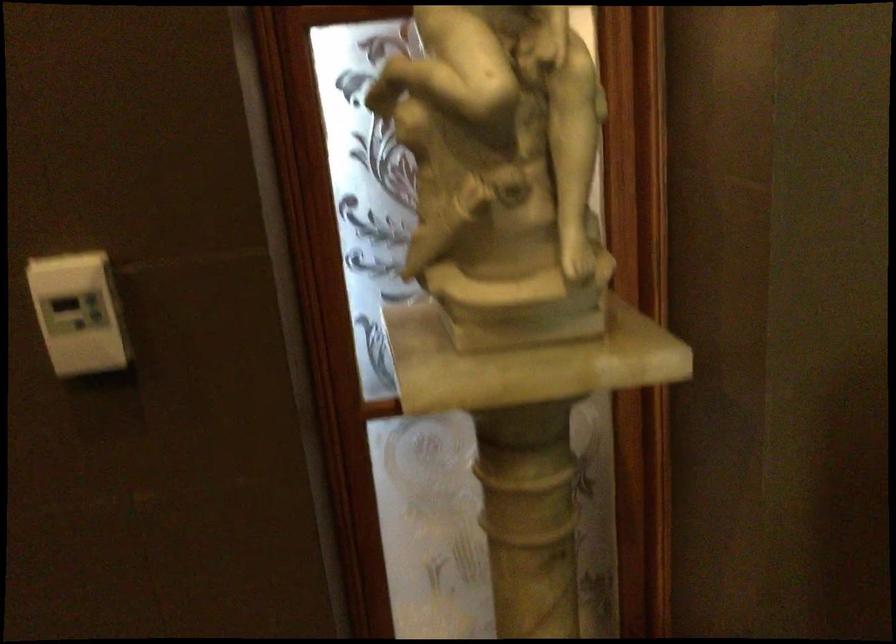
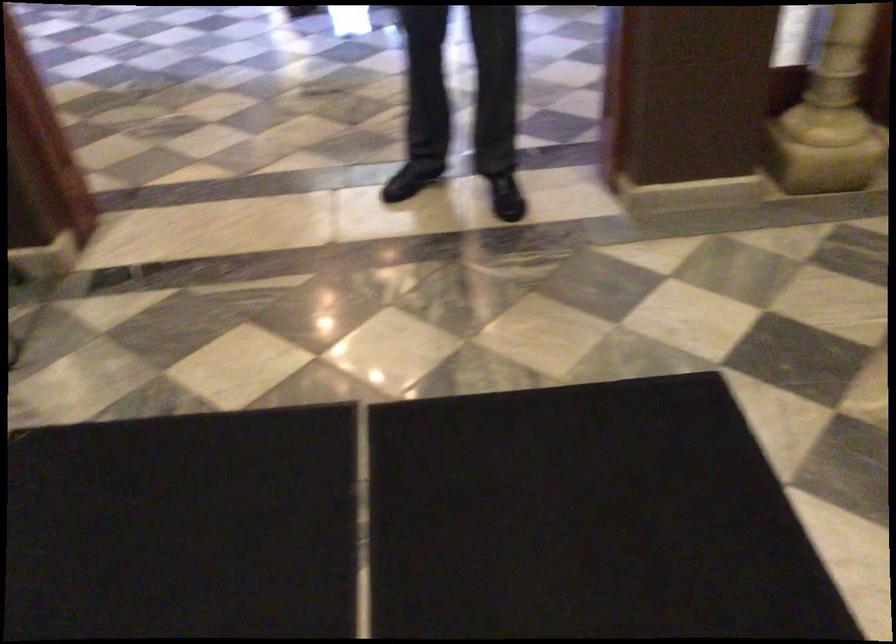
The images are taken continuously from a first-person perspective. In which direction are you moving?

The movement direction of the cameraman is left, backward.